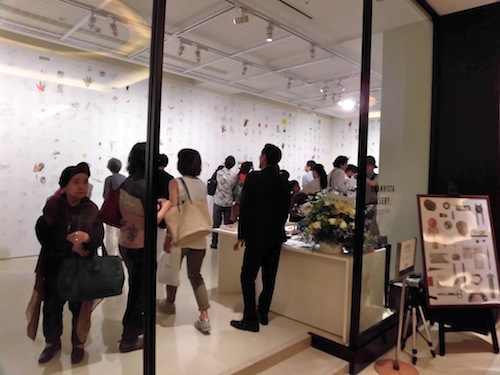
Locate an element on the screen. The image size is (500, 375). black wall is located at coordinates (484, 123).